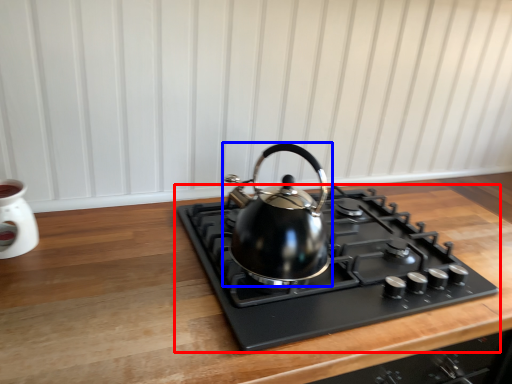
Question: Which object appears farthest to the camera in this image, gas stove (highlighted by a red box) or kettle (highlighted by a blue box)?

Choices:
 (A) gas stove
 (B) kettle

Answer: (B)